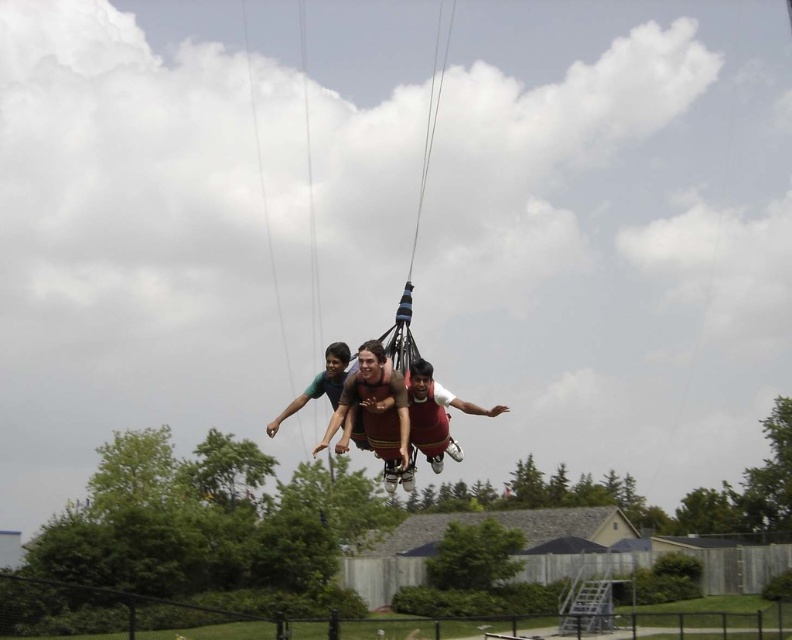
Question: Can you confirm if reddish-brown fabric parachute at center is wider than matte brown shorts at center?

Choices:
 (A) no
 (B) yes

Answer: (A)

Question: Which of the following is the farthest from the observer?

Choices:
 (A) (393, 436)
 (B) (307, 394)
 (C) (429, 144)

Answer: (C)

Question: Does reddish-brown fabric parachute at center come behind brown fabric swing at center?

Choices:
 (A) no
 (B) yes

Answer: (A)

Question: Does brown fabric parachute at center appear under reddish-brown fabric parachute at center?

Choices:
 (A) no
 (B) yes

Answer: (B)

Question: Which point is farther to the camera?

Choices:
 (A) brown fabric parachute at center
 (B) reddish-brown fabric parachute at center

Answer: (B)

Question: Which of these objects is positioned closest to the brown fabric parachute at center?

Choices:
 (A) reddish-brown fabric parachute at center
 (B) brown fabric swing at center
 (C) matte brown shorts at center

Answer: (A)